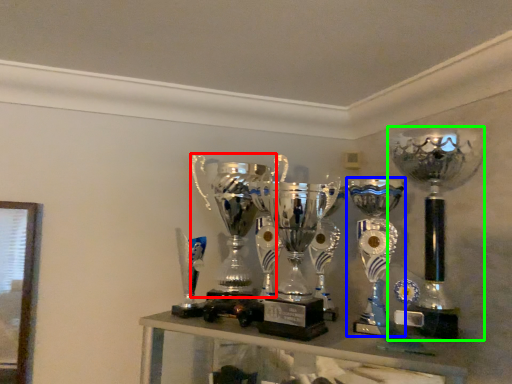
Question: Which is farther away from trophy (highlighted by a red box)? trophy (highlighted by a blue box) or trophy (highlighted by a green box)?

Choices:
 (A) trophy
 (B) trophy

Answer: (B)